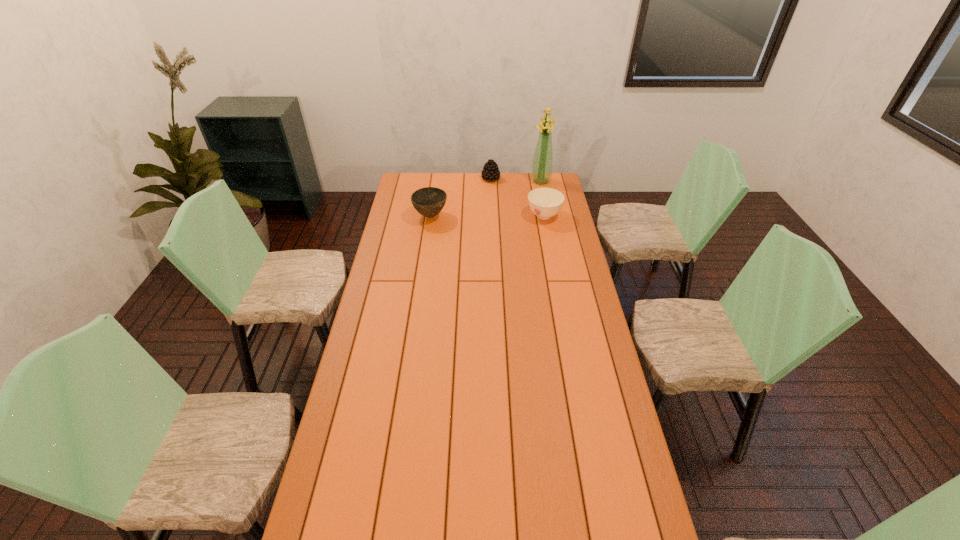
Image resolution: width=960 pixels, height=540 pixels. In order to click on bowl in this screenshot , I will do `click(429, 201)`.

At what (x,y) coordinates should I click in order to perform the action: click on sugar bowl. Please return your answer as a coordinate pair (x, y). Looking at the image, I should click on (545, 203).

Identify the location of bouquet. (541, 172).

This screenshot has height=540, width=960. What are the coordinates of `pinecone` in the screenshot? It's located at (490, 171).

Identify the location of vacant space located 0.300m on the right of the leftmost object. (506, 217).

The width and height of the screenshot is (960, 540). Find the location of `blank space located on the front of the sugar bowl`. blank space located on the front of the sugar bowl is located at coordinates (551, 251).

The image size is (960, 540). Find the location of `free space located on the front-facing side of the bouquet`. free space located on the front-facing side of the bouquet is located at coordinates (521, 199).

Where is `vacant position located on the front-facing side of the bouquet`? This screenshot has height=540, width=960. vacant position located on the front-facing side of the bouquet is located at coordinates (514, 207).

The width and height of the screenshot is (960, 540). I want to click on vacant space positioned 0.220m on the front-facing side of the bouquet, so click(517, 204).

Where is `free space located at the narrow end of the pinecone`? The width and height of the screenshot is (960, 540). free space located at the narrow end of the pinecone is located at coordinates (485, 191).